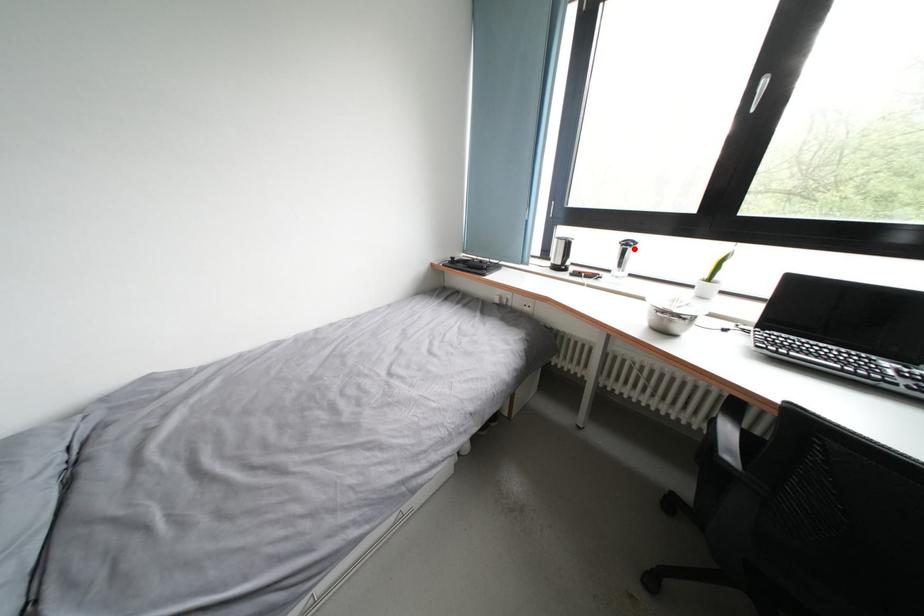
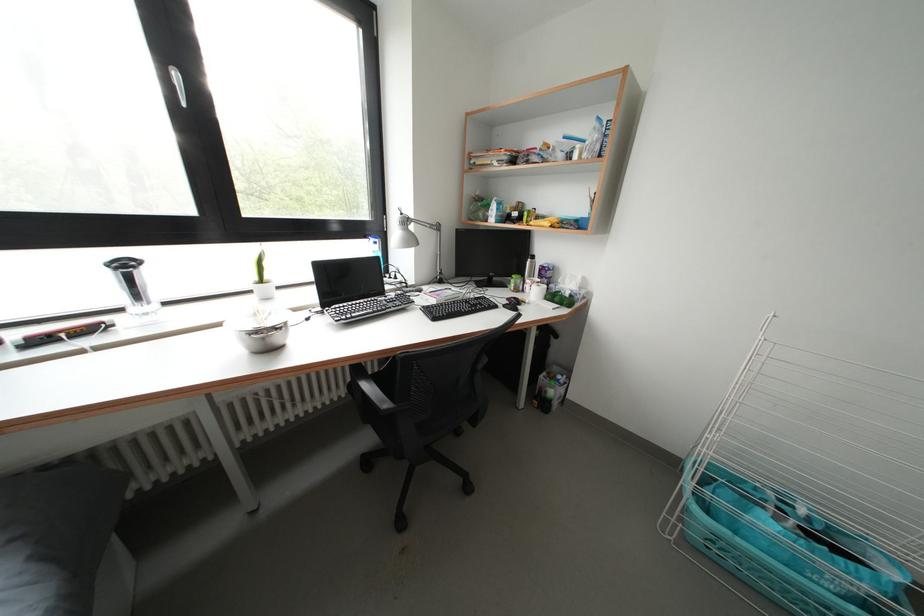
Question: I am providing you with two images of the same scene from different viewpoints. In image1, a red point is highlighted. Considering the same 3D point in image2, which of the following is correct?

Choices:
 (A) It is closer
 (B) It is farther

Answer: (B)